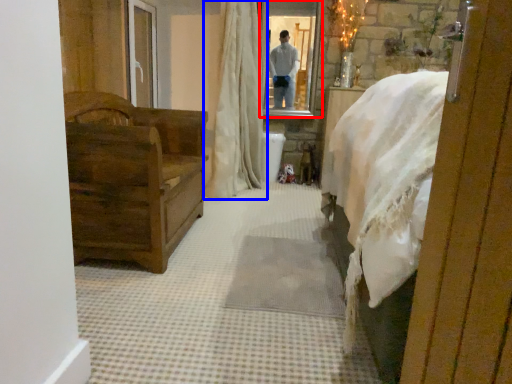
Question: Which object is closer to the camera taking this photo, mirror (highlighted by a red box) or curtain (highlighted by a blue box)?

Choices:
 (A) mirror
 (B) curtain

Answer: (B)